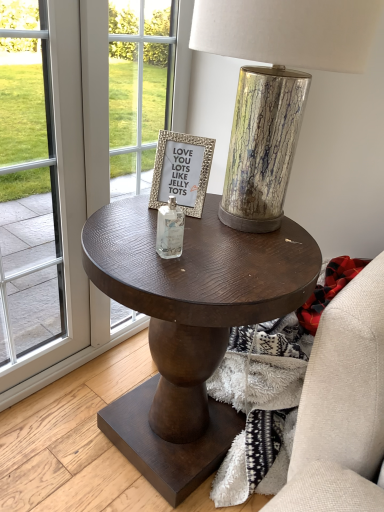
Find the location of a particular element. Image resolution: width=384 pixels, height=512 pixels. spots to the right of gold textured frame at center is located at coordinates (237, 222).